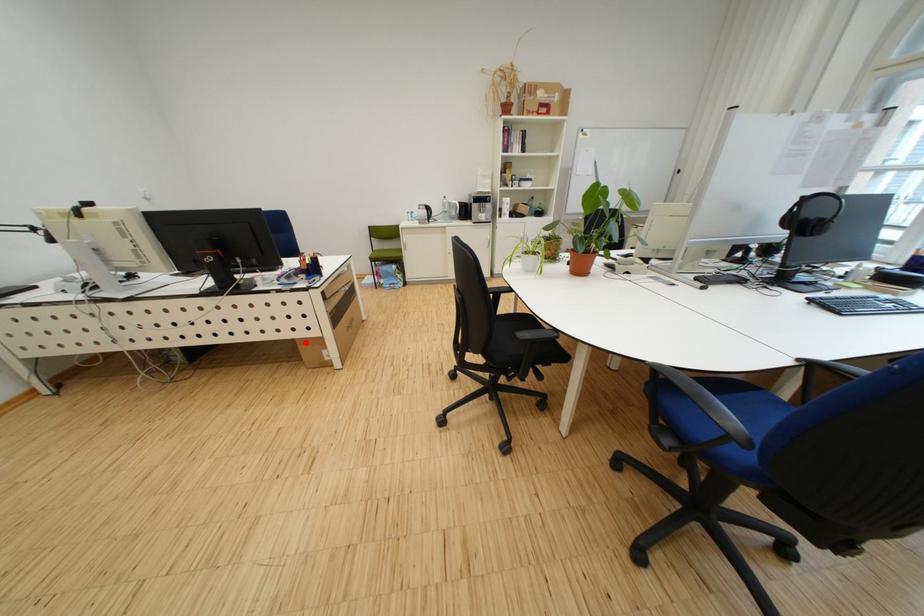
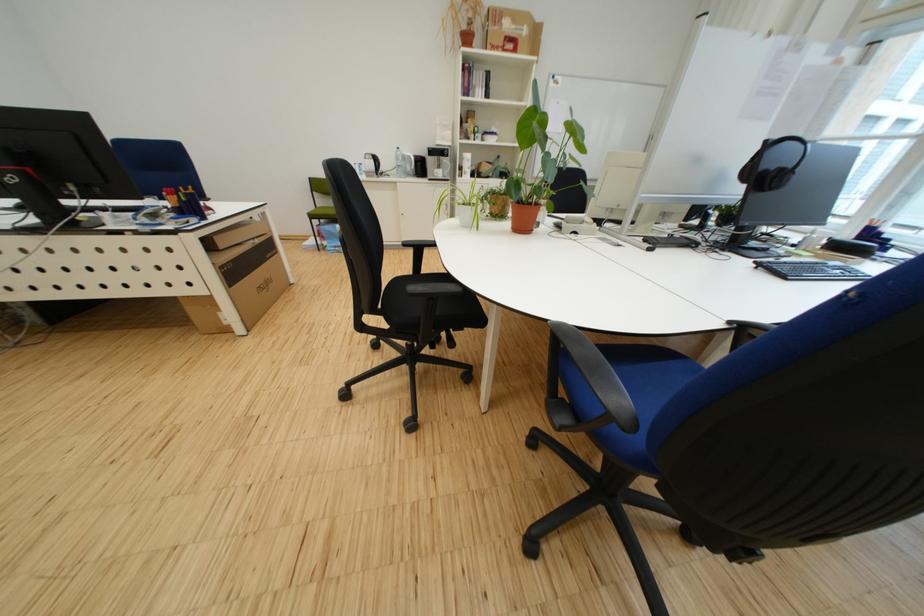
Question: I am providing you with two images of the same scene from different viewpoints. A red point is marked on the first image. Can you still see the location of the red point in image 2?

Choices:
 (A) Yes
 (B) No

Answer: (A)